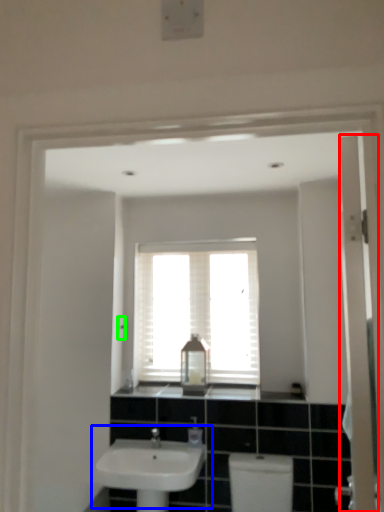
Question: Based on their relative distances, which object is nearer to screen door (highlighted by a red box)? Choose from sink (highlighted by a blue box) and light switch (highlighted by a green box).

Choices:
 (A) sink
 (B) light switch

Answer: (A)